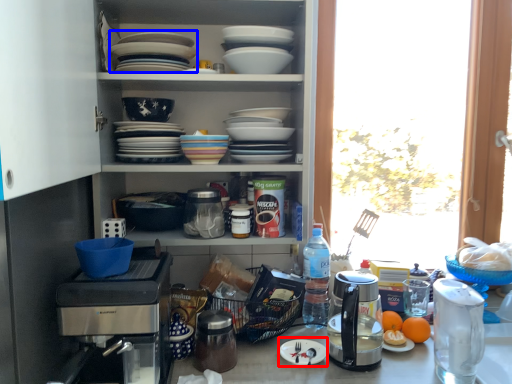
Question: Which object appears farthest to the camera in this image, paper plate (highlighted by a red box) or platter (highlighted by a blue box)?

Choices:
 (A) paper plate
 (B) platter

Answer: (A)